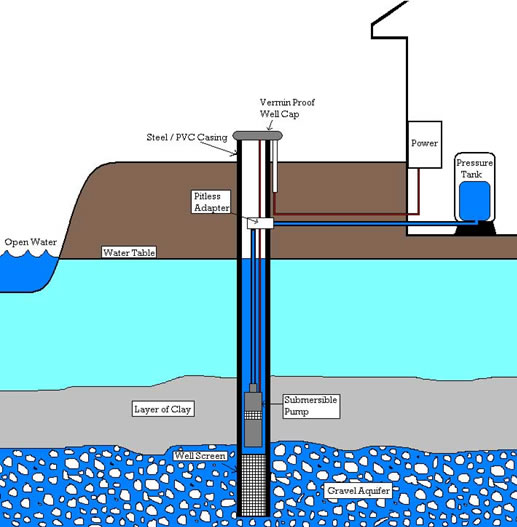
I want to click on adapter, so click(194, 204).